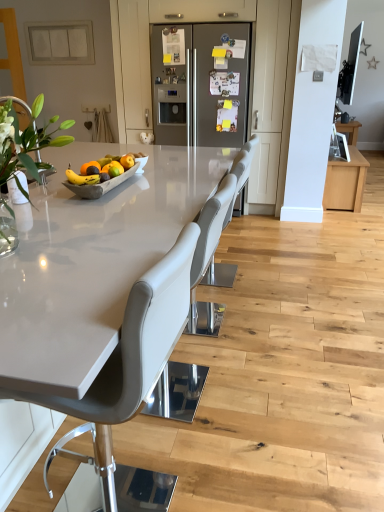
Question: Is white matte switch plate at upper left, the first cabinetry in the left-to-right sequence, shorter than orangesmoothfruit at center?

Choices:
 (A) no
 (B) yes

Answer: (A)

Question: From the image's perspective, would you say white matte switch plate at upper left, the first cabinetry in the left-to-right sequence, is shown under orangesmoothfruit at center?

Choices:
 (A) no
 (B) yes

Answer: (A)

Question: Does white matte switch plate at upper left, which ranks as the 2th cabinetry in right-to-left order, lie in front of orangesmoothfruit at center?

Choices:
 (A) yes
 (B) no

Answer: (B)

Question: From a real-world perspective, is white matte switch plate at upper left, which ranks as the 2th cabinetry in right-to-left order, located higher than orangesmoothfruit at center?

Choices:
 (A) no
 (B) yes

Answer: (B)

Question: Is white matte switch plate at upper left, the first cabinetry in the left-to-right sequence, facing towards orangesmoothfruit at center?

Choices:
 (A) no
 (B) yes

Answer: (B)

Question: Visually, is matte gray chair at center, placed as the first chair when sorted from front to back, positioned to the left or to the right of white matte switch plate at upper left, which ranks as the 2th cabinetry in right-to-left order?

Choices:
 (A) right
 (B) left

Answer: (A)

Question: Is matte gray chair at center, placed as the first chair when sorted from front to back, bigger or smaller than white matte switch plate at upper left, the first cabinetry in the left-to-right sequence?

Choices:
 (A) small
 (B) big

Answer: (B)

Question: Looking at their shapes, would you say matte gray chair at center, placed as the first chair when sorted from front to back, is wider or thinner than white matte switch plate at upper left, the first cabinetry in the left-to-right sequence?

Choices:
 (A) thin
 (B) wide

Answer: (B)

Question: From a real-world perspective, is matte gray chair at center, which is the third chair in back-to-front order, positioned above or below white matte switch plate at upper left, the first cabinetry in the left-to-right sequence?

Choices:
 (A) below
 (B) above

Answer: (A)

Question: Considering the positions of point (152, 42) and point (69, 38), is point (152, 42) closer or farther from the camera than point (69, 38)?

Choices:
 (A) closer
 (B) farther

Answer: (A)

Question: From a real-world perspective, relative to white matte switch plate at upper left, the first cabinetry in the left-to-right sequence, is satin steel refrigerator at center vertically above or below?

Choices:
 (A) above
 (B) below

Answer: (B)

Question: From the image's perspective, is satin steel refrigerator at center located above or below white matte switch plate at upper left, which ranks as the 2th cabinetry in right-to-left order?

Choices:
 (A) above
 (B) below

Answer: (B)

Question: Relative to white matte switch plate at upper left, the first cabinetry in the left-to-right sequence, is satin steel refrigerator at center in front or behind?

Choices:
 (A) front
 (B) behind

Answer: (A)

Question: Is point (148, 173) closer or farther from the camera than point (72, 188)?

Choices:
 (A) farther
 (B) closer

Answer: (A)

Question: Choose the correct answer: Is white glossy countertop at center inside wooden tray at center or outside it?

Choices:
 (A) inside
 (B) outside

Answer: (B)